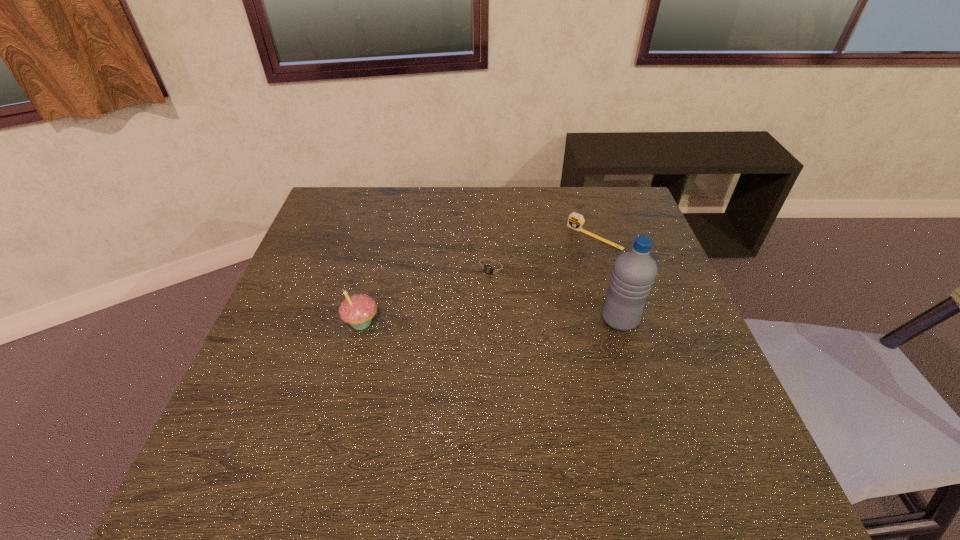
I want to click on the second tallest object, so click(357, 310).

Locate an element on the screen. cupcake is located at coordinates (357, 310).

You are a GUI agent. You are given a task and a screenshot of the screen. Output one action in this format:
    pyautogui.click(x=<x>, y=<y>)
    Task: Click on the water bottle
    The height and width of the screenshot is (540, 960).
    Given the screenshot: What is the action you would take?
    pyautogui.click(x=634, y=272)

Identify the location of the farthest object. (575, 221).

Locate an element on the screen. The height and width of the screenshot is (540, 960). the third tallest object is located at coordinates (575, 221).

I want to click on the second farthest object, so click(x=490, y=269).

The image size is (960, 540). Find the location of `the shortest object`. the shortest object is located at coordinates (490, 269).

This screenshot has height=540, width=960. What are the coordinates of `free region located on the back of the leftmost object` in the screenshot? It's located at (377, 261).

You are a GUI agent. You are given a task and a screenshot of the screen. Output one action in this format:
    pyautogui.click(x=<x>, y=<y>)
    Task: Click on the vacant space located 0.230m on the left of the water bottle
    
    Given the screenshot: What is the action you would take?
    click(504, 320)

Locate an element on the screen. Image resolution: width=960 pixels, height=540 pixels. vacant space positioned at the front of the third tallest object with the tape extended is located at coordinates (505, 318).